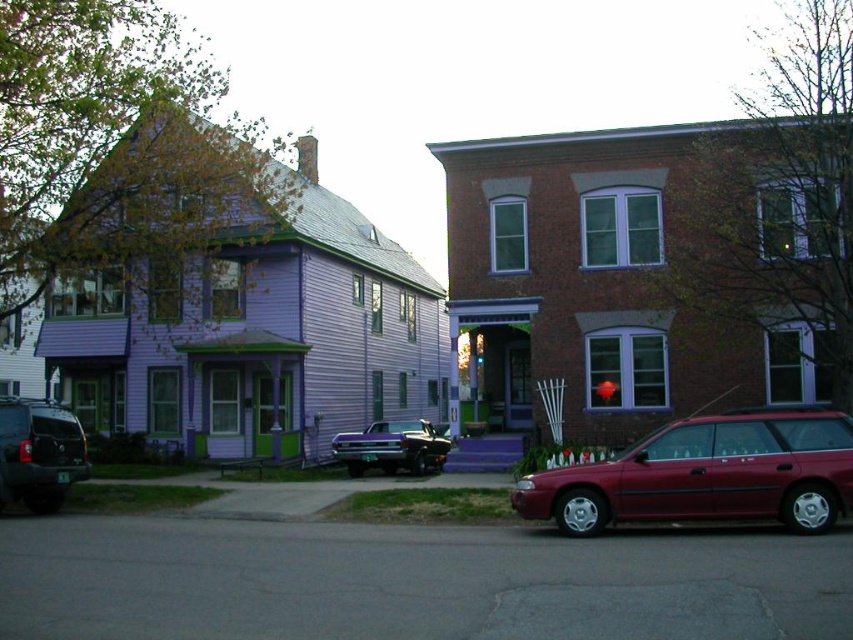
Question: Which of these objects is positioned farthest from the shiny purple car at center?

Choices:
 (A) metallic red traffic light at center
 (B) metallic red station wagon at lower right

Answer: (B)

Question: Which point is farther from the camera taking this photo?

Choices:
 (A) (480, 364)
 (B) (428, 460)
 (C) (22, 458)
 (D) (688, 499)

Answer: (A)

Question: Observing the image, what is the correct spatial positioning of metallic red station wagon at lower right in reference to matte black suv at lower left?

Choices:
 (A) above
 (B) below

Answer: (A)

Question: Does metallic red station wagon at lower right appear under shiny purple car at center?

Choices:
 (A) no
 (B) yes

Answer: (A)

Question: Which object is the farthest from the shiny purple car at center?

Choices:
 (A) metallic red traffic light at center
 (B) metallic red station wagon at lower right
 (C) matte black suv at lower left

Answer: (B)

Question: Is metallic red station wagon at lower right behind matte black suv at lower left?

Choices:
 (A) no
 (B) yes

Answer: (A)